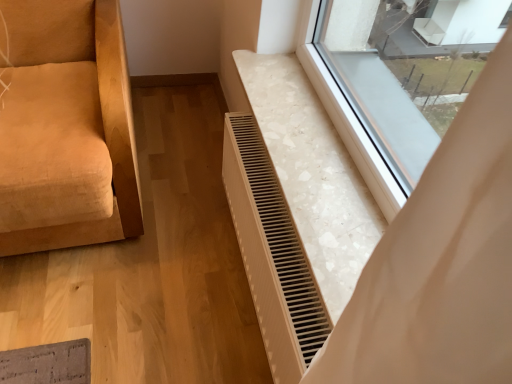
Locate an element on the screen. This screenshot has width=512, height=384. empty space that is ontop of white matte radiator at lower center (from a real-world perspective) is located at coordinates (268, 195).